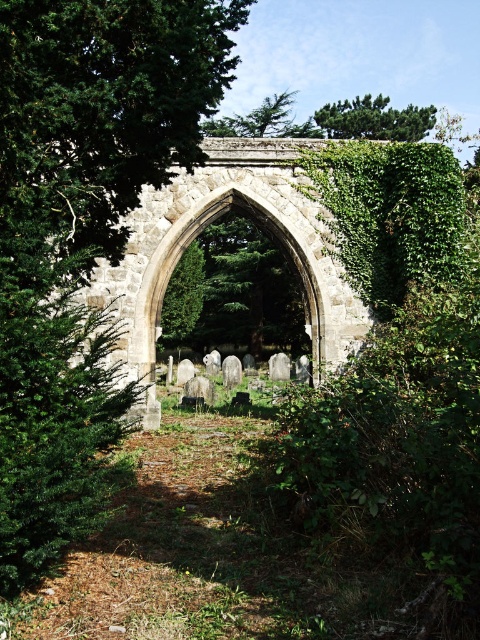
Question: Does green leafy tree at center appear over green leafy tree at upper center?

Choices:
 (A) no
 (B) yes

Answer: (A)

Question: Which point is closer to the camera taking this photo?

Choices:
 (A) (61, 310)
 (B) (372, 113)

Answer: (A)

Question: Is green leafy tree at center in front of green leafy tree at upper center?

Choices:
 (A) no
 (B) yes

Answer: (B)

Question: Observing the image, what is the correct spatial positioning of green leafy tree at center in reference to green leafy tree at upper center?

Choices:
 (A) right
 (B) left

Answer: (B)

Question: Which object is closer to the camera taking this photo?

Choices:
 (A) green leafy tree at upper center
 (B) green leafy tree at center

Answer: (B)